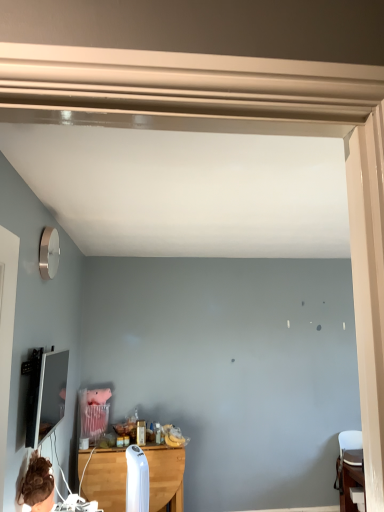
Question: Is matte black tv at left inside or outside of wooden table at lower right, which appears as the second table when viewed from the left?

Choices:
 (A) inside
 (B) outside

Answer: (B)

Question: Is matte black tv at left wider or thinner than wooden table at lower right, positioned as the 1th table in right-to-left order?

Choices:
 (A) thin
 (B) wide

Answer: (A)

Question: Considering the real-world distances, which object is farthest from the wooden table at lower right, which appears as the second table when viewed from the left?

Choices:
 (A) wooden table at center, the second table when ordered from right to left
 (B) matte black tv at left

Answer: (B)

Question: Based on their relative distances, which object is farther from the wooden table at lower right, which appears as the second table when viewed from the left?

Choices:
 (A) wooden table at center, the second table when ordered from right to left
 (B) matte black tv at left

Answer: (B)